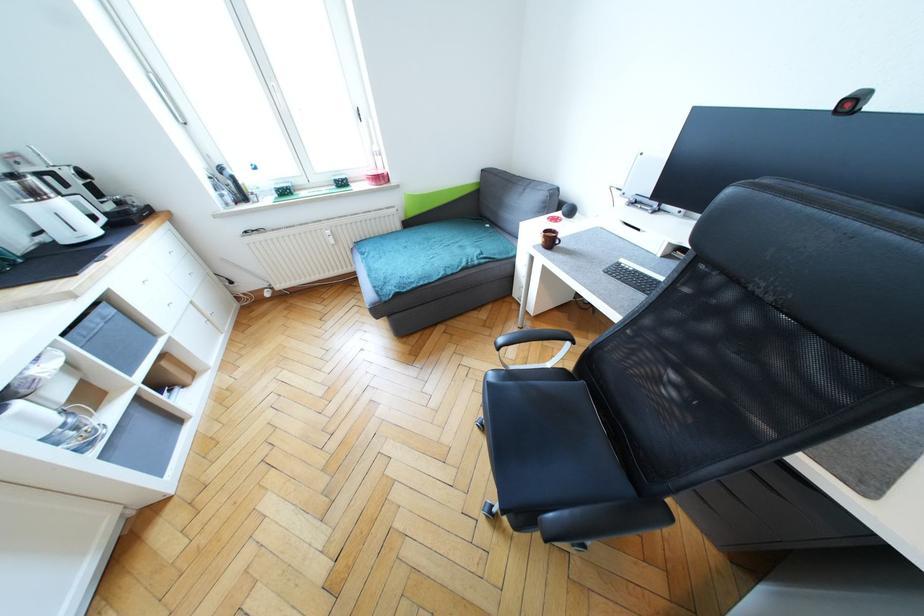
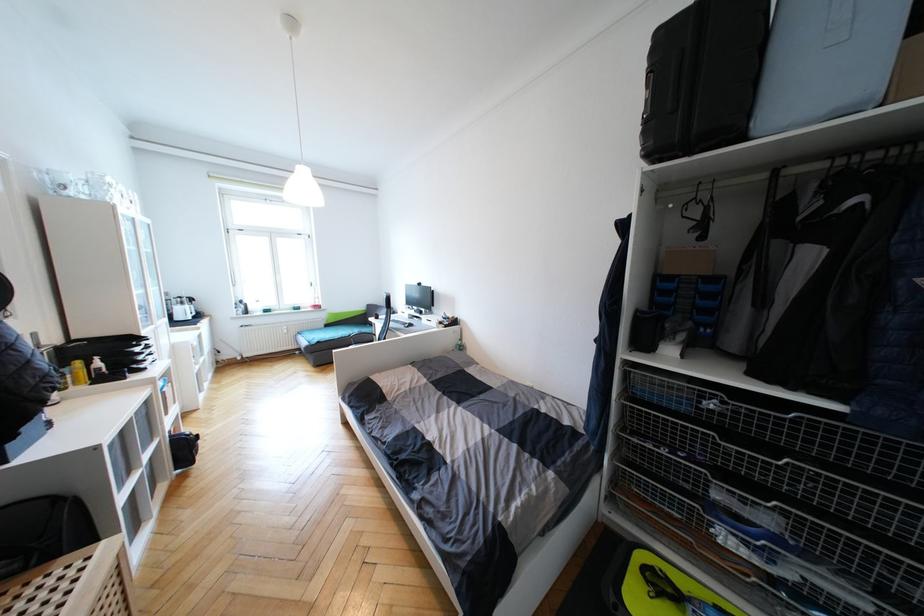
Locate, in the second image, the point that corresponds to point (40, 196) in the first image.

(186, 305)